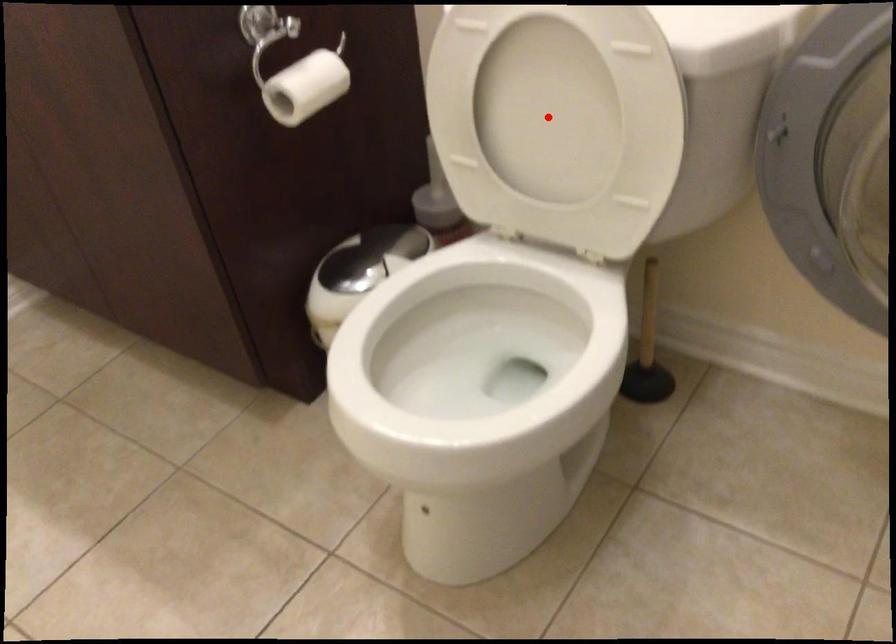
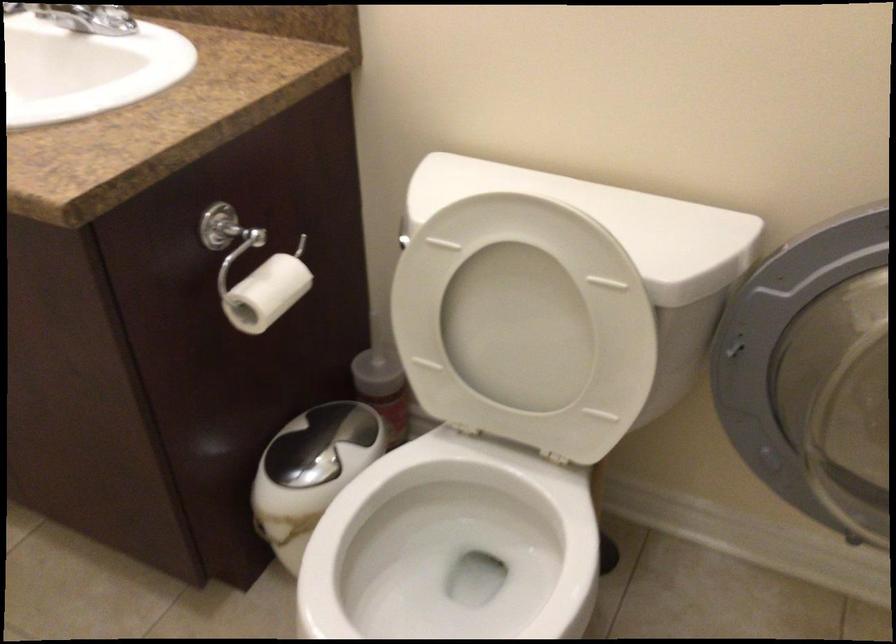
Locate, in the second image, the point that corresponds to the highlighted location in the first image.

(517, 328)